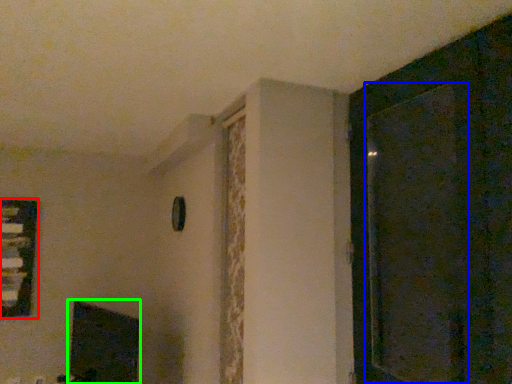
Question: Based on their relative distances, which object is farther from window (highlighted by a red box)? Choose from screen door (highlighted by a blue box) and fireplace (highlighted by a green box).

Choices:
 (A) screen door
 (B) fireplace

Answer: (A)